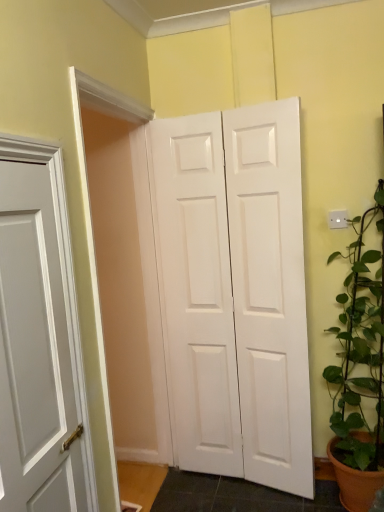
The height and width of the screenshot is (512, 384). I want to click on vacant space to the left of white matte door at center, so click(188, 490).